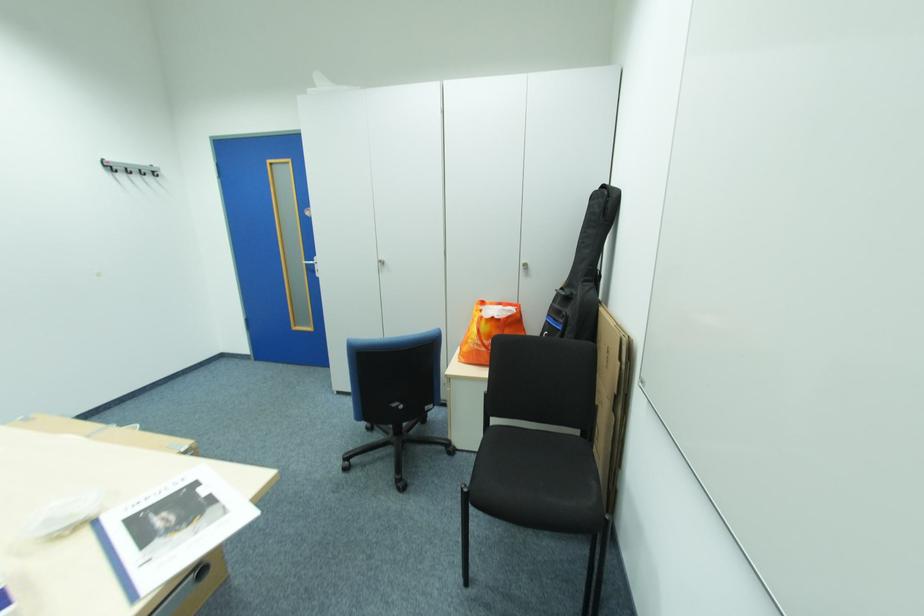
Find where to hang the metal wall hook. Please return your answer as a coordinate pair (x, y).

(129, 168)